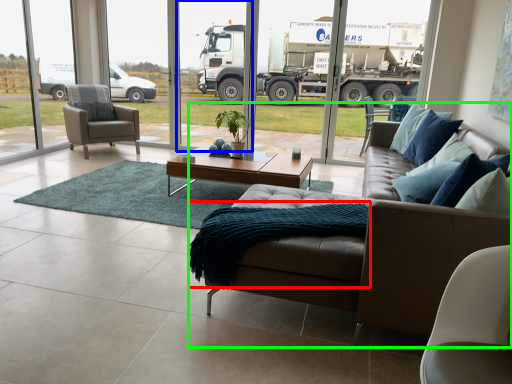
Question: Which object is the farthest from blanket (highlighted by a red box)? Choose among these: screen door (highlighted by a blue box) or studio couch (highlighted by a green box).

Choices:
 (A) screen door
 (B) studio couch

Answer: (A)